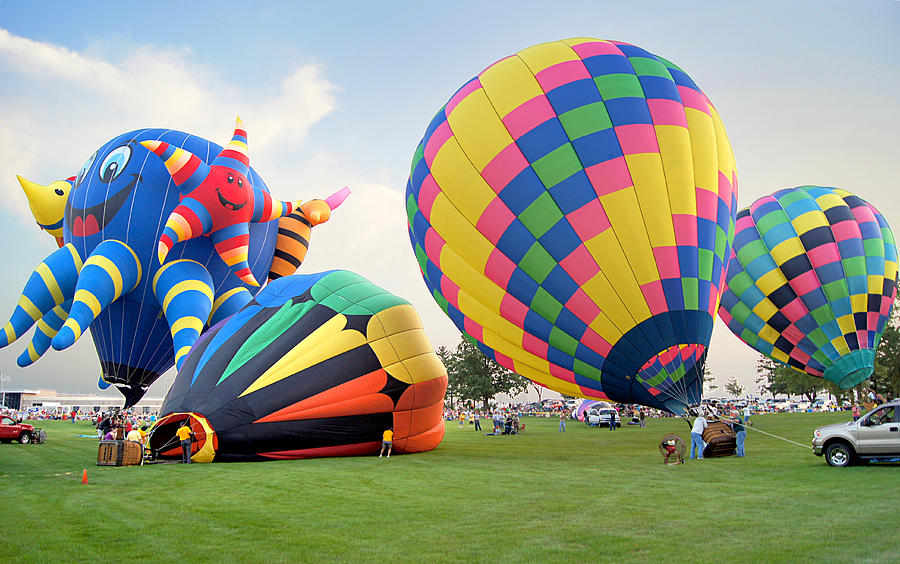
The width and height of the screenshot is (900, 564). In order to click on door in this screenshot , I will do `click(873, 435)`.